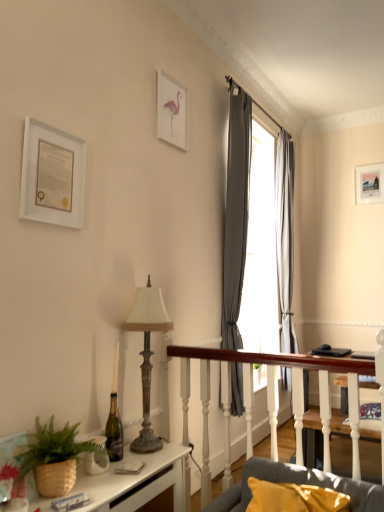
Question: Does gray fabric curtain at upper right, the first curtain positioned from the left, have a smaller size compared to gray fabric curtain at upper right, which is the 2th curtain in front-to-back order?

Choices:
 (A) yes
 (B) no

Answer: (B)

Question: Is there a large distance between gray fabric curtain at upper right, the first curtain positioned from the left, and gray fabric curtain at upper right, the 1th curtain viewed from the right?

Choices:
 (A) no
 (B) yes

Answer: (A)

Question: Does gray fabric curtain at upper right, the first curtain positioned from the left, have a greater width compared to gray fabric curtain at upper right, placed as the 1th curtain when sorted from back to front?

Choices:
 (A) no
 (B) yes

Answer: (A)

Question: Can you confirm if gray fabric curtain at upper right, the first curtain positioned from the left, is thinner than gray fabric curtain at upper right, placed as the 1th curtain when sorted from back to front?

Choices:
 (A) no
 (B) yes

Answer: (B)

Question: From a real-world perspective, does gray fabric curtain at upper right, the 1th curtain in the front-to-back sequence, sit lower than gray fabric curtain at upper right, positioned as the second curtain in left-to-right order?

Choices:
 (A) no
 (B) yes

Answer: (B)

Question: Considering the positions of point (286, 479) and point (160, 442), is point (286, 479) closer or farther from the camera than point (160, 442)?

Choices:
 (A) farther
 (B) closer

Answer: (B)

Question: Considering the positions of gray fabric couch at lower right and antique brass lamp at center-left in the image, is gray fabric couch at lower right wider or thinner than antique brass lamp at center-left?

Choices:
 (A) thin
 (B) wide

Answer: (B)

Question: From the image's perspective, is gray fabric couch at lower right above or below antique brass lamp at center-left?

Choices:
 (A) below
 (B) above

Answer: (A)

Question: Relative to antique brass lamp at center-left, is gray fabric couch at lower right in front or behind?

Choices:
 (A) front
 (B) behind

Answer: (A)

Question: Considering the positions of white matte picture frame at upper left, which is counted as the 3th picture frame, starting from the right, and gray fabric curtain at upper right, positioned as the second curtain in back-to-front order, in the image, is white matte picture frame at upper left, which is counted as the 3th picture frame, starting from the right, wider or thinner than gray fabric curtain at upper right, positioned as the second curtain in back-to-front order,?

Choices:
 (A) wide
 (B) thin

Answer: (B)

Question: Would you say white matte picture frame at upper left, arranged as the first picture frame when viewed from the left, is inside or outside gray fabric curtain at upper right, positioned as the second curtain in back-to-front order?

Choices:
 (A) inside
 (B) outside

Answer: (B)

Question: Considering the positions of white matte picture frame at upper left, which is the third picture frame from back to front, and gray fabric curtain at upper right, the first curtain positioned from the left, in the image, is white matte picture frame at upper left, which is the third picture frame from back to front, bigger or smaller than gray fabric curtain at upper right, the first curtain positioned from the left,?

Choices:
 (A) big
 (B) small

Answer: (B)

Question: Is white matte picture frame at upper left, which is counted as the 3th picture frame, starting from the right, taller or shorter than gray fabric curtain at upper right, positioned as the second curtain in back-to-front order?

Choices:
 (A) short
 (B) tall

Answer: (A)

Question: Would you say gray fabric curtain at upper right, which is the 2th curtain in front-to-back order, is to the left or to the right of gray fabric couch at lower right in the picture?

Choices:
 (A) left
 (B) right

Answer: (B)

Question: Is gray fabric curtain at upper right, placed as the 1th curtain when sorted from back to front, taller or shorter than gray fabric couch at lower right?

Choices:
 (A) tall
 (B) short

Answer: (A)